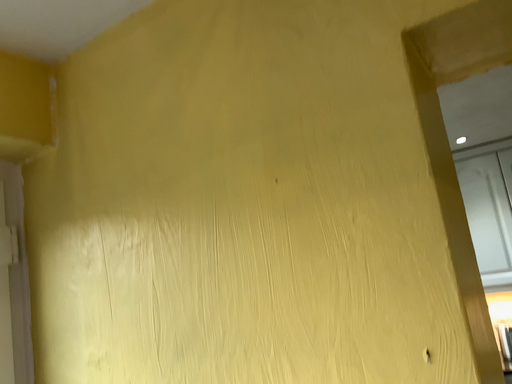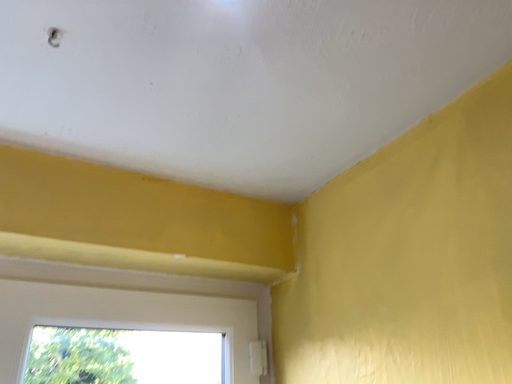
Question: Which way did the camera rotate in the video?

Choices:
 (A) rotated upward
 (B) rotated downward

Answer: (A)